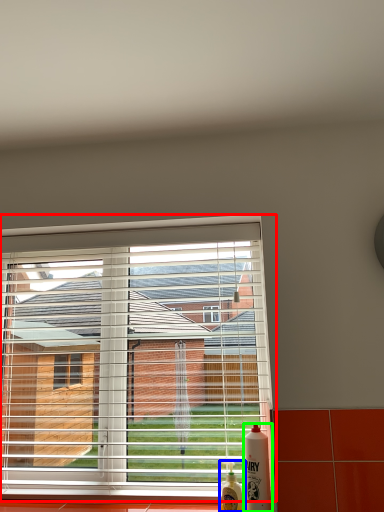
Question: Based on their relative distances, which object is farther from window (highlighted by a red box)? Choose from bottle (highlighted by a blue box) and bottle (highlighted by a green box).

Choices:
 (A) bottle
 (B) bottle

Answer: (A)